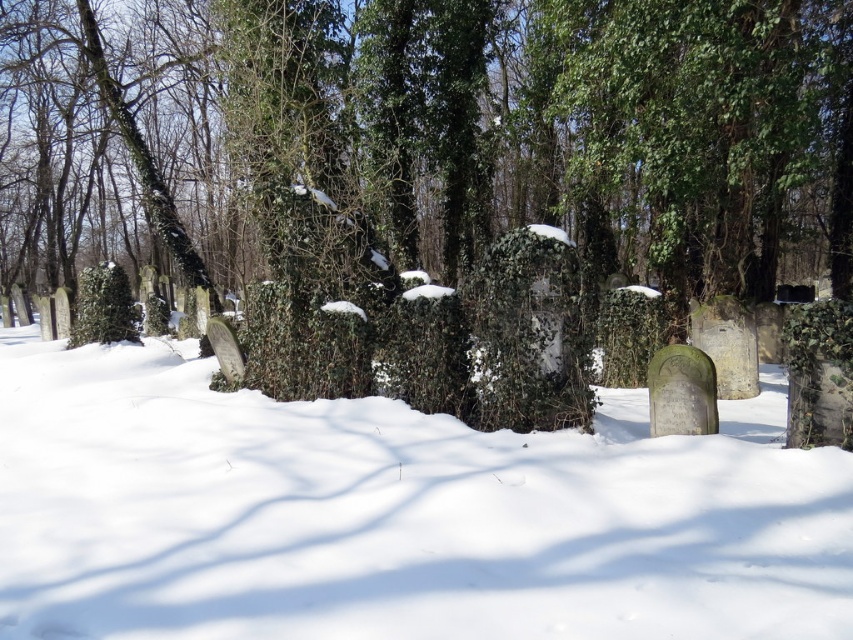
Question: Is green ivy-covered tree at center thinner than stone at center?

Choices:
 (A) yes
 (B) no

Answer: (B)

Question: Estimate the real-world distances between objects in this image. Which object is closer to the stone at center?

Choices:
 (A) white powdery snow at center
 (B) green ivy-covered tree at center
 (C) gray stone gravestone at center

Answer: (A)

Question: Observing the image, what is the correct spatial positioning of gray stone gravestone at center in reference to stone at center?

Choices:
 (A) above
 (B) below

Answer: (B)

Question: Which point is farther from the camera taking this photo?

Choices:
 (A) (740, 401)
 (B) (650, 394)

Answer: (A)

Question: Considering the real-world distances, which object is farthest from the gray stone gravestone at center?

Choices:
 (A) green ivy-covered tree at center
 (B) white powdery snow at center
 (C) stone at center

Answer: (A)

Question: Observing the image, what is the correct spatial positioning of white powdery snow at center in reference to gray stone gravestone at center?

Choices:
 (A) left
 (B) right

Answer: (A)